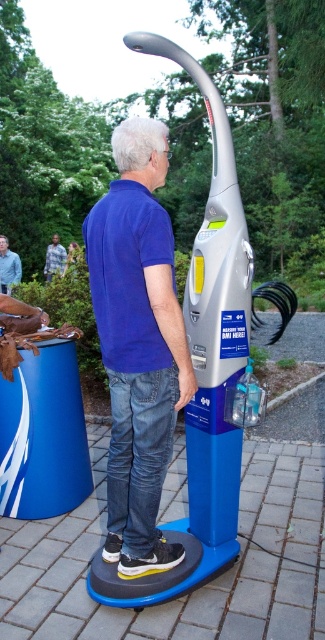
Between blue matte shirt at center and blue shirt at upper center, which one is positioned higher?

blue shirt at upper center is higher up.

Between blue matte shirt at center and blue shirt at upper center, which one has more height?

blue matte shirt at center is taller.

Find the location of a particular element. blue matte shirt at center is located at coordinates [x=138, y=342].

I want to click on blue matte shirt at center, so click(x=138, y=342).

Is blue shirt at upper center bigger than green textured shirt at center?

Incorrect, blue shirt at upper center is not larger than green textured shirt at center.

Is point (0, 288) closer to viewer compared to point (54, 268)?

Yes, it is in front of point (54, 268).

This screenshot has width=325, height=640. In order to click on blue shirt at upper center in this screenshot , I will do `click(8, 266)`.

Is blue matte shirt at center to the right of green textured shirt at center from the viewer's perspective?

Yes, blue matte shirt at center is to the right of green textured shirt at center.

Who is more distant from viewer, (109, 340) or (63, 253)?

Point (63, 253)

Does point (135, 164) come in front of point (59, 244)?

Yes, it is.

Where is `blue matte shirt at center`? Image resolution: width=325 pixels, height=640 pixels. blue matte shirt at center is located at coordinates (138, 342).